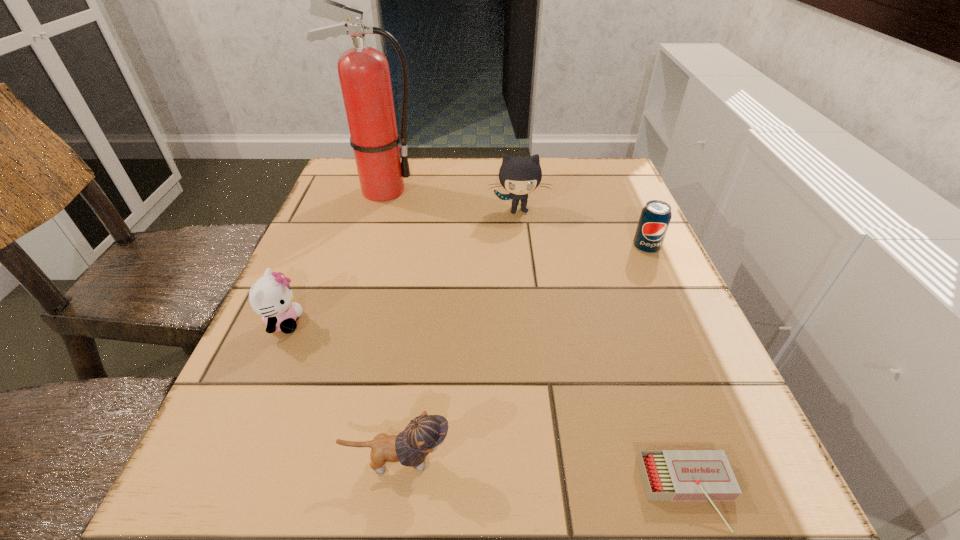
Where is `free space at the far right corner`? This screenshot has width=960, height=540. free space at the far right corner is located at coordinates (612, 173).

At what (x,y) coordinates should I click in order to perform the action: click on vacant region at the near right corner. Please return your answer as a coordinate pair (x, y). This screenshot has height=540, width=960. Looking at the image, I should click on (690, 506).

Locate an element on the screen. Image resolution: width=960 pixels, height=540 pixels. free space between the tallest object and the soda can is located at coordinates pos(514,219).

Locate an element on the screen. The width and height of the screenshot is (960, 540). vacant region between the leftmost kitten and the rightmost object is located at coordinates (465, 285).

I want to click on free spot between the fire extinguisher and the second nearest kitten, so click(332, 256).

You are a GUI agent. You are given a task and a screenshot of the screen. Output one action in this format:
    pyautogui.click(x=<x>, y=<y>)
    Task: Click on the unoccupied position between the soda can and the fire extinguisher
    The image size is (960, 540).
    Given the screenshot: What is the action you would take?
    pyautogui.click(x=514, y=219)

Locate an element on the screen. The width and height of the screenshot is (960, 540). blank region between the matchbox and the fire extinguisher is located at coordinates (535, 342).

You are a GUI agent. You are given a task and a screenshot of the screen. Output one action in this format:
    pyautogui.click(x=<x>, y=<y>)
    Task: Click on the vacant point located between the leftmost kitten and the second kitten from right to left
    Image resolution: width=960 pixels, height=540 pixels.
    Given the screenshot: What is the action you would take?
    [x=341, y=392]

The width and height of the screenshot is (960, 540). What are the coordinates of `vacant space in between the tallest object and the rightmost kitten` in the screenshot? It's located at (450, 200).

Find the location of a particular element. The height and width of the screenshot is (540, 960). free space between the third nearest object and the fire extinguisher is located at coordinates (332, 256).